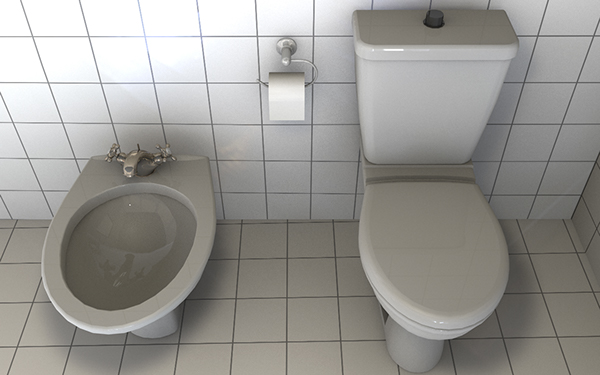
Locate an element on the screen. toilet is located at coordinates (435, 203).